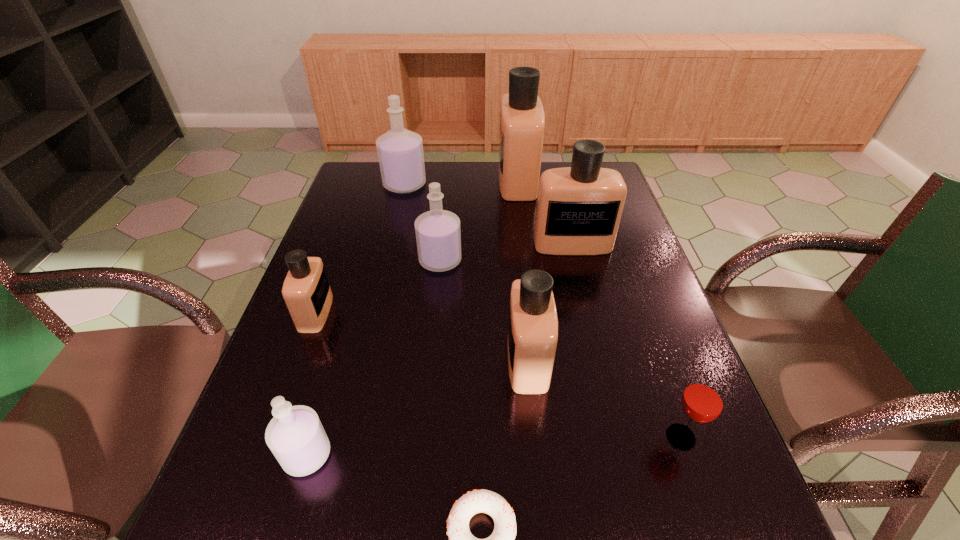
Find the location of a particular element. the tallest perfume is located at coordinates (522, 119).

Where is `the tallest object`? Image resolution: width=960 pixels, height=540 pixels. the tallest object is located at coordinates (522, 119).

This screenshot has height=540, width=960. Identify the location of the biggest purple perfume. (400, 153).

Find the location of a particular element. This screenshot has height=540, width=960. the second farthest beige perfume is located at coordinates (579, 208).

Identify the location of the second farthest purple perfume. Image resolution: width=960 pixels, height=540 pixels. (438, 236).

Image resolution: width=960 pixels, height=540 pixels. Identify the location of the second smallest purple perfume. (438, 236).

Where is `the third biggest beige perfume`? The height and width of the screenshot is (540, 960). the third biggest beige perfume is located at coordinates (532, 340).

The image size is (960, 540). I want to click on the nearest purple perfume, so click(295, 435).

Locate an element on the screen. Image resolution: width=960 pixels, height=540 pixels. the nearest perfume is located at coordinates (295, 435).

Locate an element on the screen. the leftmost object is located at coordinates (306, 290).